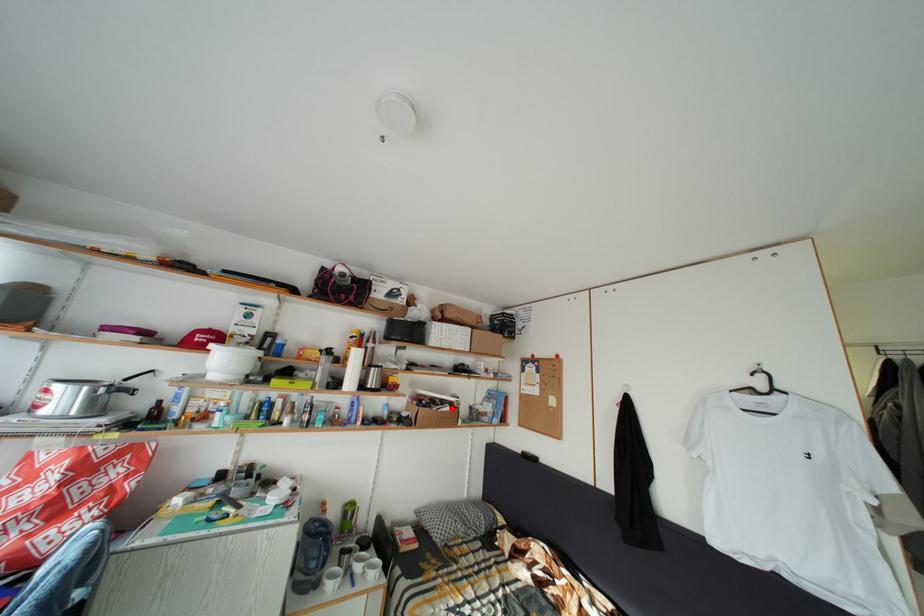
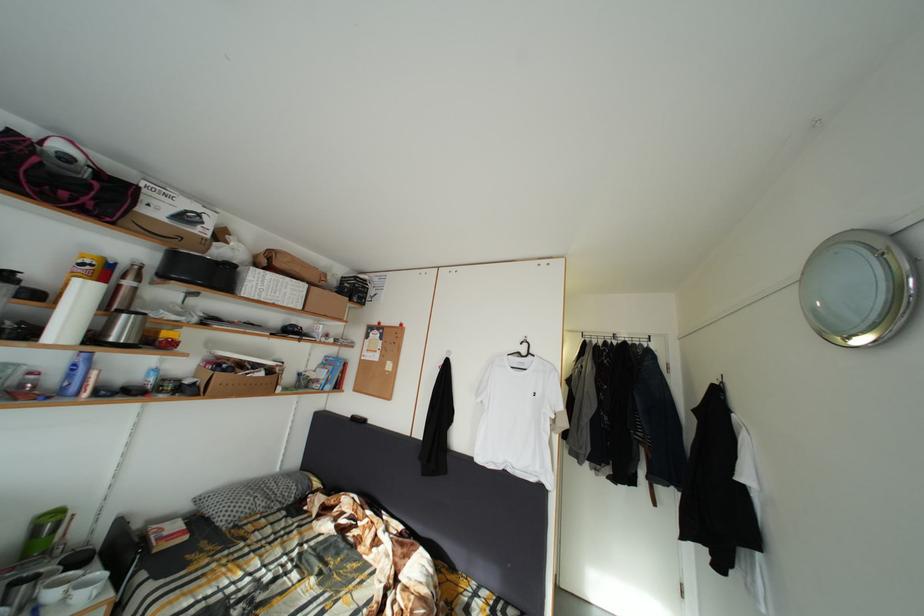
In the second image, find the point that corresponds to the highlighted location in the first image.

(264, 373)